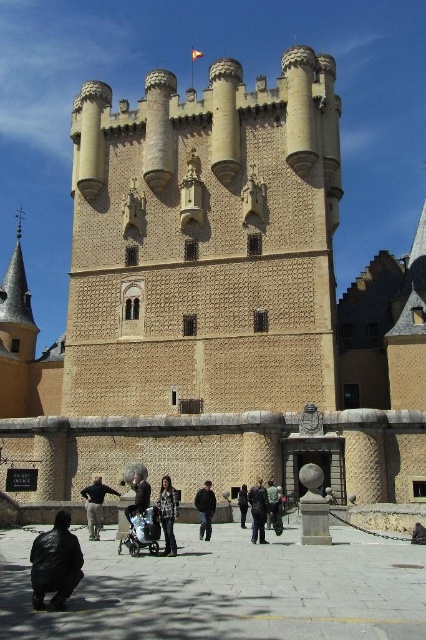
You are standing in the courtyard in front of the historic stone tower. You notice two points marked in the scene. The first point is at coordinates point (89, 493) and the second is at point (264, 529). If you were to walk from the first point to the second, would you be moving towards the tower or away from it?

Since point (89, 493) is behind point (264, 529), moving from the first point to the second would mean moving away from the tower. Therefore, you would be moving away from the tower.

You are a photographer standing in the courtyard of the historic stone tower. You notice a person wearing a dark brown leather jacket at lower left and dark blue jeans at center. Which piece of clothing is positioned higher from the ground?

The dark brown leather jacket at lower left is above the dark blue jeans at center, meaning it is positioned higher from the ground.

You are a tourist standing in the courtyard of the historic stone tower. You see a dark brown leather jacket at lower left. If you want to pick it up, where should you walk to?

You should walk to the location at point coordinates of (95,504) to pick up the dark brown leather jacket at lower left.